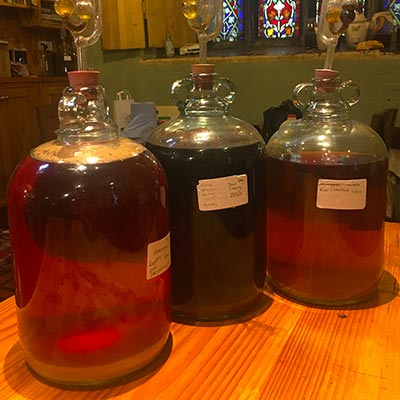
Locate an element on the screen. The width and height of the screenshot is (400, 400). green wall is located at coordinates (121, 62), (152, 67), (152, 76), (243, 77), (245, 109), (288, 61), (276, 80), (360, 70), (386, 72), (375, 96).